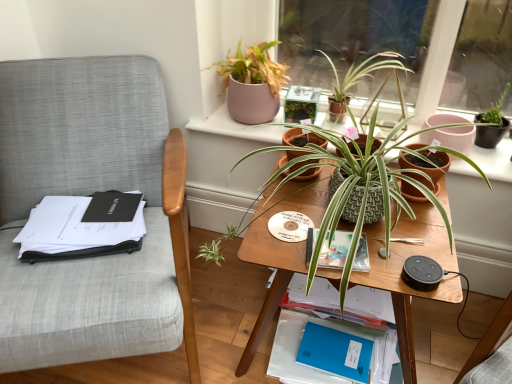
Locate an element on the screen. free location to the right of hardcover book at center, which appears as the 2th paperback book when viewed from the back is located at coordinates (401, 241).